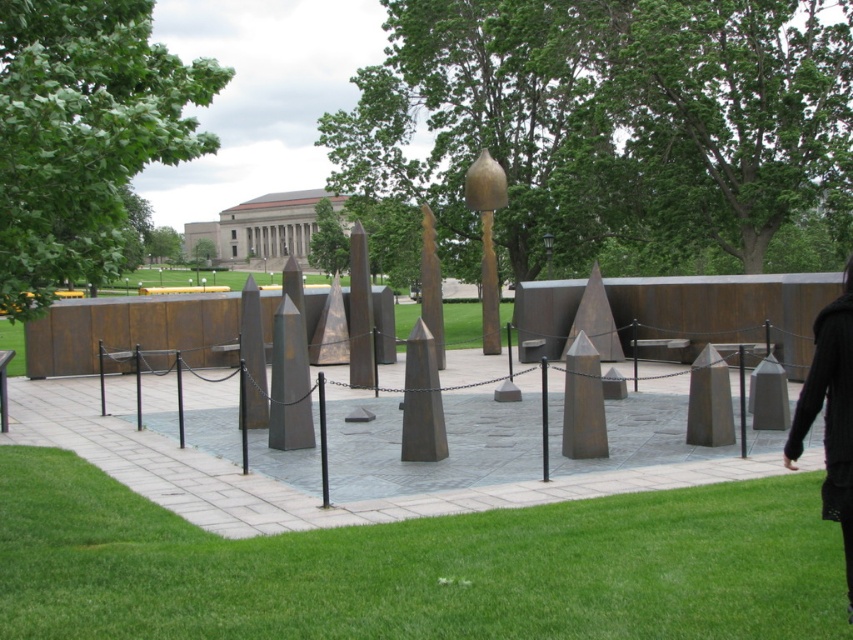
Question: Which point is farther to the camera?

Choices:
 (A) black wool coat at lower right
 (B) gold matte obelisk at center

Answer: (B)

Question: Which object is closer to the camera taking this photo?

Choices:
 (A) green grass at lower center
 (B) gold matte obelisk at center
 (C) black wool coat at lower right

Answer: (C)

Question: Which is nearer to the black wool coat at lower right?

Choices:
 (A) gold matte obelisk at center
 (B) green grass at lower center

Answer: (B)

Question: Does green grass at lower center appear over gold matte obelisk at center?

Choices:
 (A) no
 (B) yes

Answer: (A)

Question: Observing the image, what is the correct spatial positioning of green grass at lower center in reference to black wool coat at lower right?

Choices:
 (A) left
 (B) right

Answer: (A)

Question: Is green grass at lower center above gold matte obelisk at center?

Choices:
 (A) no
 (B) yes

Answer: (A)